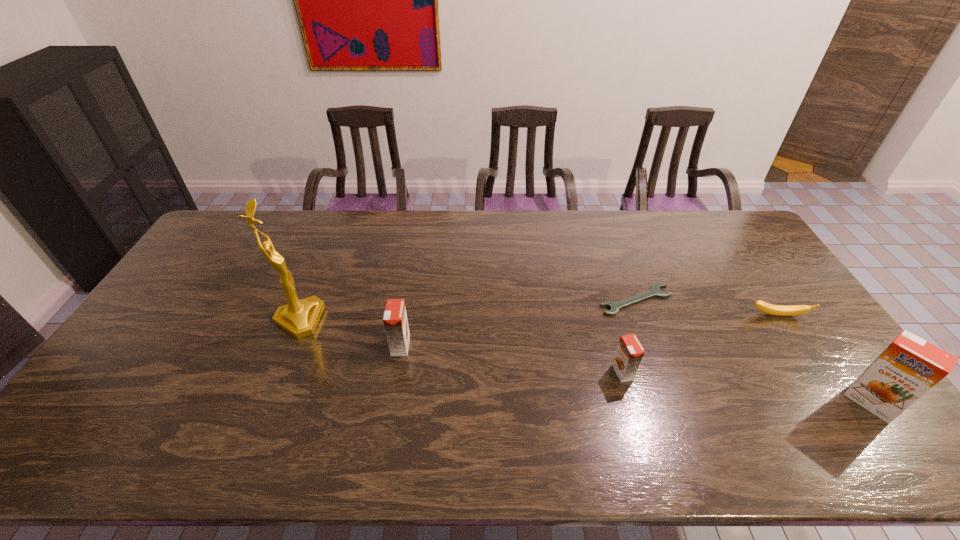
This screenshot has height=540, width=960. Find the location of `free space for a new orange juice on the left`. free space for a new orange juice on the left is located at coordinates (201, 321).